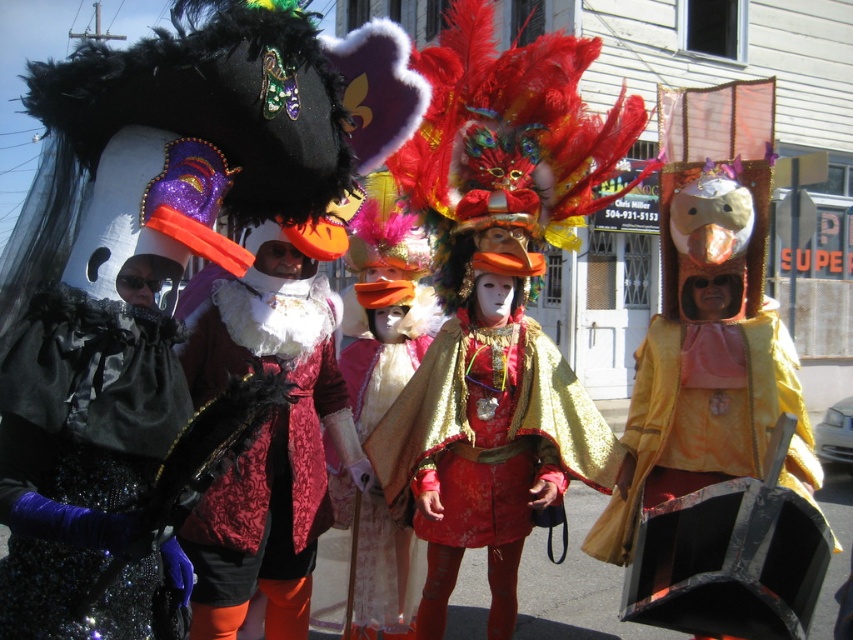
Question: Does velvet/red dress at center appear on the left side of velvet pink cape at center?

Choices:
 (A) no
 (B) yes

Answer: (B)

Question: Where is velvet/red dress at center located in relation to velvet pink cape at center in the image?

Choices:
 (A) left
 (B) right

Answer: (A)

Question: From the image, what is the correct spatial relationship of velvet/red dress at center in relation to velvet pink cape at center?

Choices:
 (A) left
 (B) right

Answer: (A)

Question: Estimate the real-world distances between objects in this image. Which object is closer to the velvet pink cape at center?

Choices:
 (A) metallic gold cape at center
 (B) velvet/red dress at center
 (C) shiny black fabric at left

Answer: (B)

Question: Which is nearer to the velvet/red dress at center?

Choices:
 (A) metallic gold cape at center
 (B) velvet pink cape at center
 (C) shiny black fabric at left

Answer: (B)

Question: Which of these objects is positioned closest to the metallic gold cape at center?

Choices:
 (A) velvet/red dress at center
 (B) velvet pink cape at center

Answer: (B)